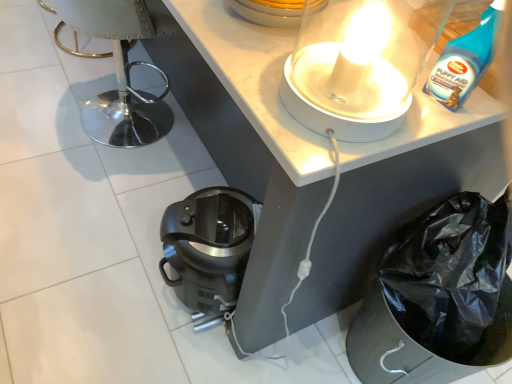
Question: Is white glossy lamp at upper center outside of metallic silver swivel chair at left?

Choices:
 (A) no
 (B) yes

Answer: (B)

Question: Is white glossy lamp at upper center thinner than metallic silver swivel chair at left?

Choices:
 (A) yes
 (B) no

Answer: (A)

Question: Does white glossy lamp at upper center come behind metallic silver swivel chair at left?

Choices:
 (A) no
 (B) yes

Answer: (A)

Question: From the image's perspective, is white glossy lamp at upper center under metallic silver swivel chair at left?

Choices:
 (A) no
 (B) yes

Answer: (B)

Question: Is white glossy lamp at upper center oriented away from metallic silver swivel chair at left?

Choices:
 (A) yes
 (B) no

Answer: (B)

Question: Is white glossy lamp at upper center smaller than metallic silver swivel chair at left?

Choices:
 (A) yes
 (B) no

Answer: (A)

Question: From a real-world perspective, does white glossy lamp at upper center sit lower than black plastic coffee maker at lower center?

Choices:
 (A) yes
 (B) no

Answer: (B)

Question: Can we say white glossy lamp at upper center lies outside black plastic coffee maker at lower center?

Choices:
 (A) yes
 (B) no

Answer: (A)

Question: Is white glossy lamp at upper center not near black plastic coffee maker at lower center?

Choices:
 (A) yes
 (B) no

Answer: (B)

Question: Does white glossy lamp at upper center have a lesser width compared to black plastic coffee maker at lower center?

Choices:
 (A) yes
 (B) no

Answer: (A)

Question: Is the depth of white glossy lamp at upper center less than that of black plastic coffee maker at lower center?

Choices:
 (A) no
 (B) yes

Answer: (B)

Question: Considering the relative sizes of white glossy lamp at upper center and black plastic coffee maker at lower center in the image provided, is white glossy lamp at upper center smaller than black plastic coffee maker at lower center?

Choices:
 (A) no
 (B) yes

Answer: (B)

Question: Is matte black coffee maker at lower center taller than blue plastic bottle at upper right?

Choices:
 (A) no
 (B) yes

Answer: (A)